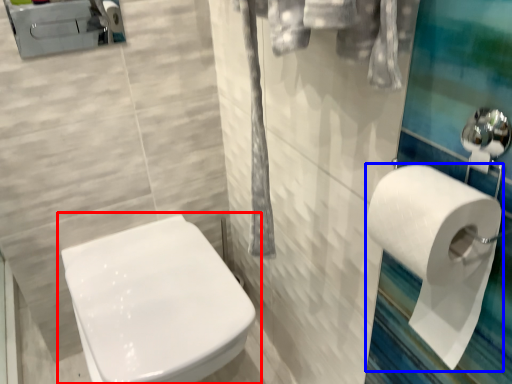
Question: Which object appears closest to the camera in this image, toilet (highlighted by a red box) or toilet paper (highlighted by a blue box)?

Choices:
 (A) toilet
 (B) toilet paper

Answer: (B)